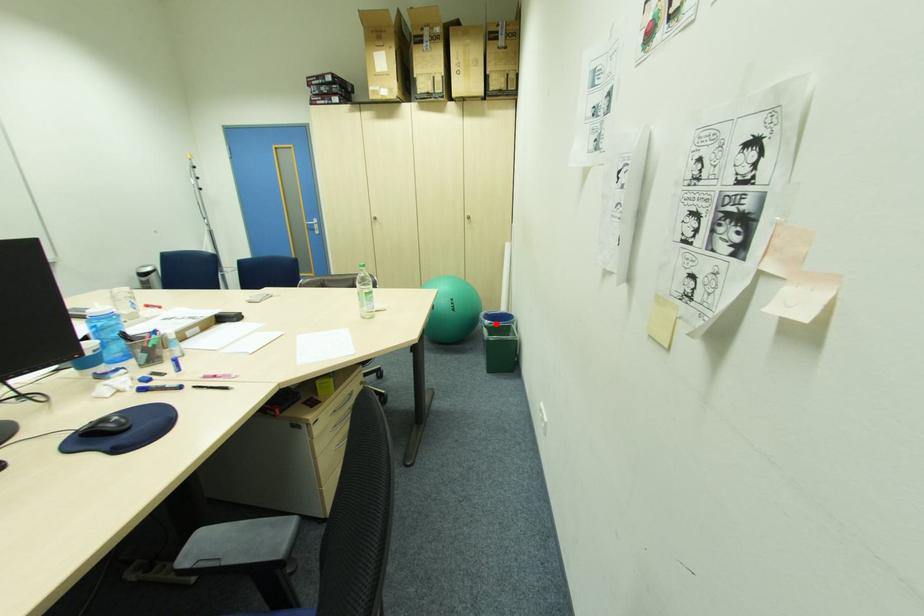
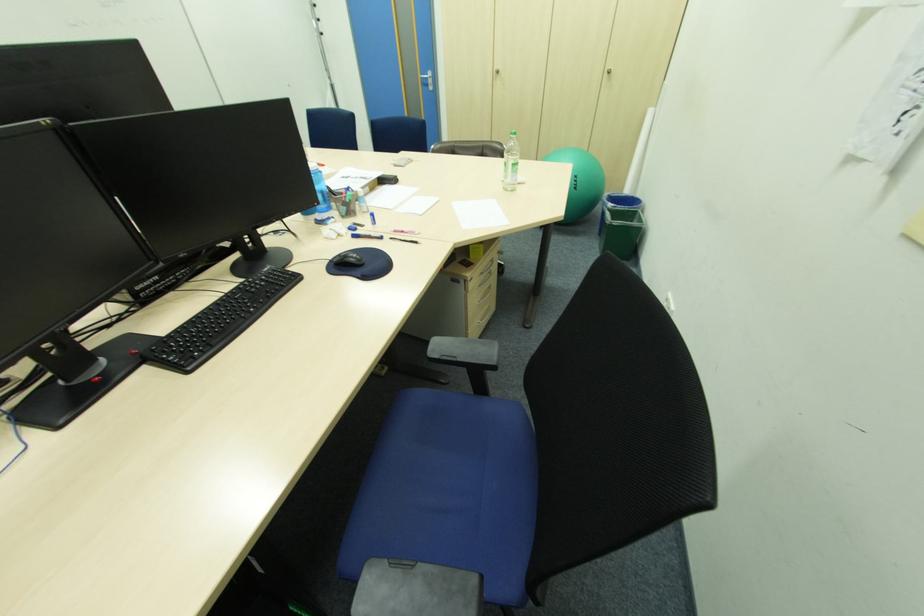
Question: I am providing you with two images of the same scene from different viewpoints. Given a red point in image1, look at the same physical point in image2. Is it:

Choices:
 (A) Closer to the viewpoint
 (B) Farther from the viewpoint

Answer: (A)